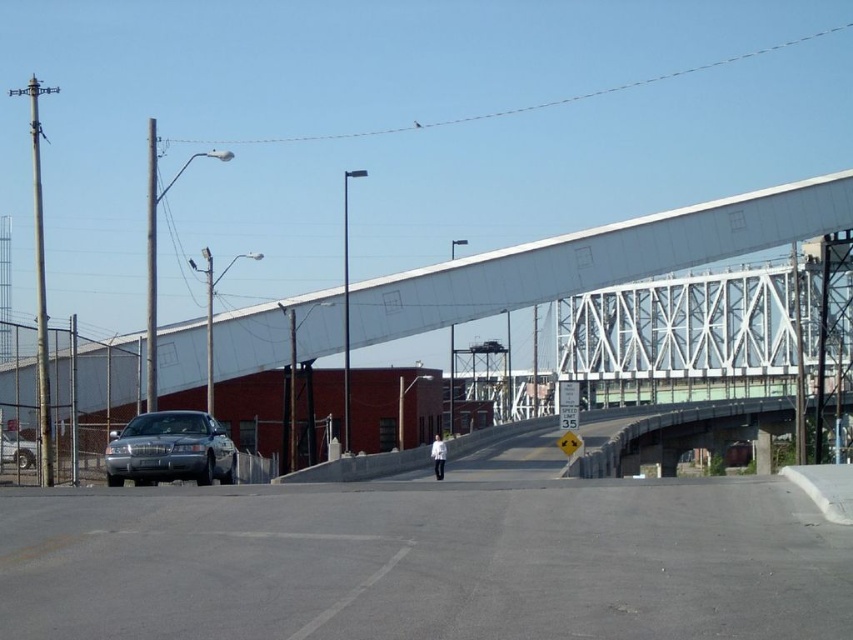
Is point (699, 256) in front of point (4, 458)?

No.

Identify the location of white metallic bridge at center. The width and height of the screenshot is (853, 640). (596, 259).

Locate an element on the screen. white metallic bridge at center is located at coordinates (596, 259).

Can you confirm if white metallic bridge at center is bigger than satin silver sedan at center?

Correct, white metallic bridge at center is larger in size than satin silver sedan at center.

Which of these two, white metallic bridge at center or satin silver sedan at center, stands shorter?

With less height is satin silver sedan at center.

Is point (691, 256) in front of point (207, 413)?

No.

Find the location of a particular element. This screenshot has width=853, height=640. white metallic bridge at center is located at coordinates (596, 259).

Is shiny silver sedan at left to the right of white matte jacket at center from the viewer's perspective?

Incorrect, shiny silver sedan at left is not on the right side of white matte jacket at center.

Is point (26, 451) positioned behind point (434, 461)?

No, (26, 451) is closer to viewer.

Locate an element on the screen. Image resolution: width=853 pixels, height=640 pixels. shiny silver sedan at left is located at coordinates (18, 451).